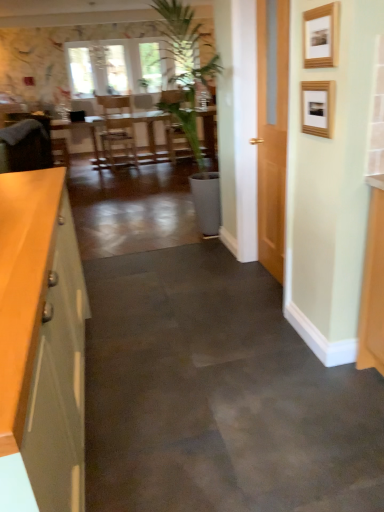
Question: Can you confirm if velvet brown armchair at left is shorter than matte gray cabinet at left?

Choices:
 (A) yes
 (B) no

Answer: (B)

Question: Considering the relative sizes of velvet brown armchair at left and matte gray cabinet at left in the image provided, is velvet brown armchair at left smaller than matte gray cabinet at left?

Choices:
 (A) yes
 (B) no

Answer: (A)

Question: Can you confirm if velvet brown armchair at left is thinner than matte gray cabinet at left?

Choices:
 (A) yes
 (B) no

Answer: (B)

Question: From the image's perspective, is velvet brown armchair at left under matte gray cabinet at left?

Choices:
 (A) no
 (B) yes

Answer: (A)

Question: From a real-world perspective, does velvet brown armchair at left sit lower than matte gray cabinet at left?

Choices:
 (A) no
 (B) yes

Answer: (A)

Question: Does point (94, 117) appear closer or farther from the camera than point (64, 248)?

Choices:
 (A) farther
 (B) closer

Answer: (A)

Question: Looking at their shapes, would you say wooden table at center is wider or thinner than matte gray cabinet at left?

Choices:
 (A) wide
 (B) thin

Answer: (A)

Question: Looking at the image, does wooden table at center seem bigger or smaller compared to matte gray cabinet at left?

Choices:
 (A) big
 (B) small

Answer: (A)

Question: Based on their positions, is wooden table at center located to the left or right of matte gray cabinet at left?

Choices:
 (A) left
 (B) right

Answer: (A)

Question: Is wooden picture frame at upper right, which appears as the second picture frame when viewed from the top, inside or outside of velvet brown armchair at left?

Choices:
 (A) outside
 (B) inside

Answer: (A)

Question: Is wooden picture frame at upper right, which appears as the second picture frame when viewed from the top, taller or shorter than velvet brown armchair at left?

Choices:
 (A) short
 (B) tall

Answer: (A)

Question: Considering the positions of wooden picture frame at upper right, which appears as the second picture frame when viewed from the top, and velvet brown armchair at left in the image, is wooden picture frame at upper right, which appears as the second picture frame when viewed from the top, wider or thinner than velvet brown armchair at left?

Choices:
 (A) wide
 (B) thin

Answer: (B)

Question: Considering their positions, is wooden picture frame at upper right, which appears as the second picture frame when viewed from the top, located in front of or behind velvet brown armchair at left?

Choices:
 (A) front
 (B) behind

Answer: (A)

Question: Visually, is velvet brown armchair at left positioned to the left or to the right of wooden picture frame at upper right, placed as the second picture frame when sorted from bottom to top?

Choices:
 (A) left
 (B) right

Answer: (A)

Question: Considering their positions, is velvet brown armchair at left located in front of or behind wooden picture frame at upper right, placed as the second picture frame when sorted from bottom to top?

Choices:
 (A) front
 (B) behind

Answer: (B)